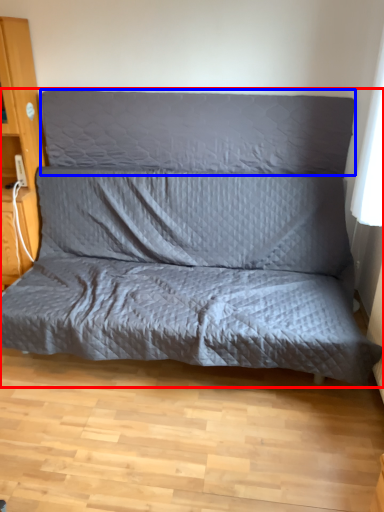
Question: Which object appears closest to the camera in this image, studio couch (highlighted by a red box) or pillow (highlighted by a blue box)?

Choices:
 (A) studio couch
 (B) pillow

Answer: (A)